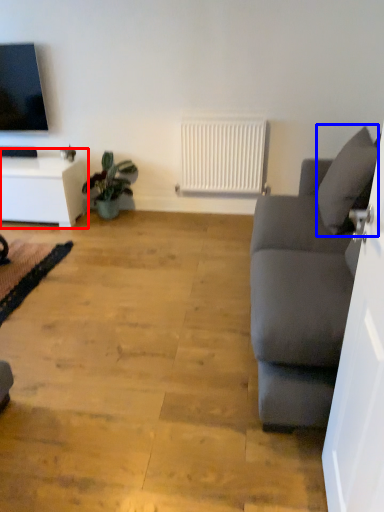
Question: Which object appears farthest to the camera in this image, table (highlighted by a red box) or pillow (highlighted by a blue box)?

Choices:
 (A) table
 (B) pillow

Answer: (A)